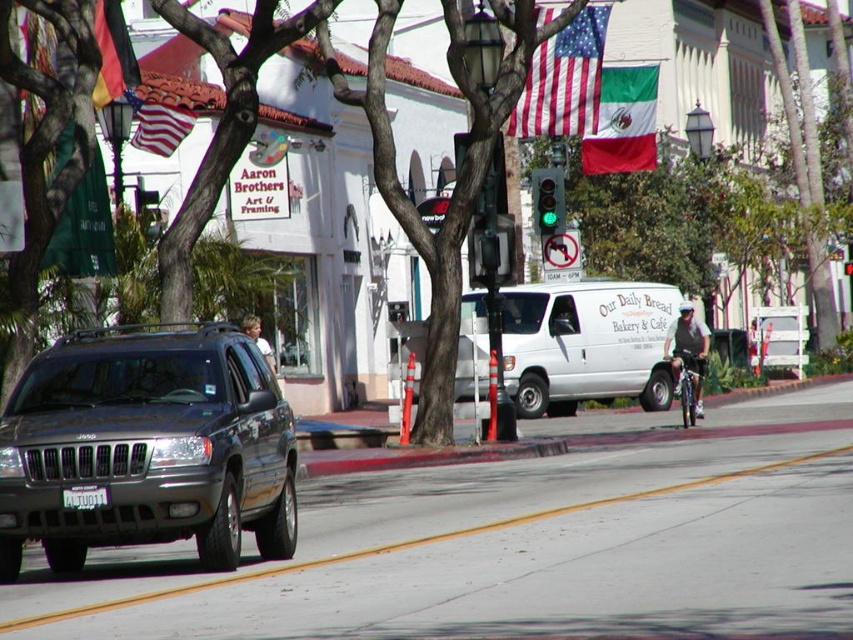
You are standing at the point with coordinates point (91, 506) and want to walk towards the point (543, 109). Based on the scene, will you be moving towards the background or the foreground?

You will be moving towards the foreground because point (543, 109) is closer to the viewer than point (91, 506).

Based on the photo, you are a pedestrian standing at the intersection and want to cross the street. You see a green and white fabric flag at upper center and a green glass traffic light at center. Which object is located to the right of the other?

The green and white fabric flag at upper center is positioned on the right side of green glass traffic light at center.

You are a pedestrian standing at the crosswalk. You see the american flag at upper center and the white plastic license plate at center. Which object is closer to you?

The white plastic license plate at center is behind the american flag at upper center, so the american flag at upper center is closer to you.